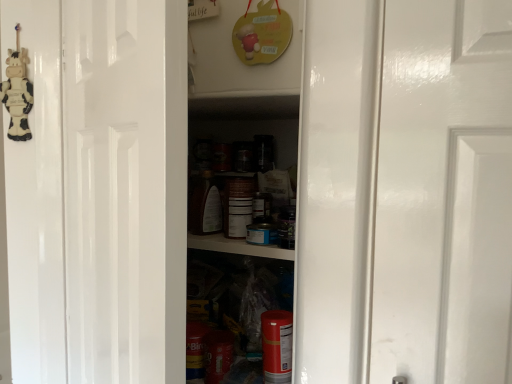
Question: Is glossy white door at center smaller than cow-patterned plush at left?

Choices:
 (A) yes
 (B) no

Answer: (B)

Question: Is the depth of glossy white door at center greater than that of cow-patterned plush at left?

Choices:
 (A) no
 (B) yes

Answer: (A)

Question: Does glossy white door at center have a lesser height compared to cow-patterned plush at left?

Choices:
 (A) yes
 (B) no

Answer: (B)

Question: Is glossy white door at center taller than cow-patterned plush at left?

Choices:
 (A) yes
 (B) no

Answer: (A)

Question: Is glossy white door at center next to cow-patterned plush at left and touching it?

Choices:
 (A) no
 (B) yes

Answer: (A)

Question: Does glossy white door at center have a lesser width compared to cow-patterned plush at left?

Choices:
 (A) yes
 (B) no

Answer: (B)

Question: From a real-world perspective, is cow-patterned plush at left over glossy white door at center?

Choices:
 (A) yes
 (B) no

Answer: (A)

Question: Is cow-patterned plush at left at the left side of glossy white door at center?

Choices:
 (A) yes
 (B) no

Answer: (A)

Question: Is cow-patterned plush at left positioned before glossy white door at center?

Choices:
 (A) no
 (B) yes

Answer: (A)

Question: Does cow-patterned plush at left have a greater width compared to glossy white door at center?

Choices:
 (A) yes
 (B) no

Answer: (B)

Question: Is cow-patterned plush at left placed right next to glossy white door at center?

Choices:
 (A) no
 (B) yes

Answer: (A)

Question: Is cow-patterned plush at left looking in the opposite direction of glossy white door at center?

Choices:
 (A) yes
 (B) no

Answer: (B)

Question: Is point (10, 79) positioned closer to the camera than point (74, 36)?

Choices:
 (A) closer
 (B) farther

Answer: (B)